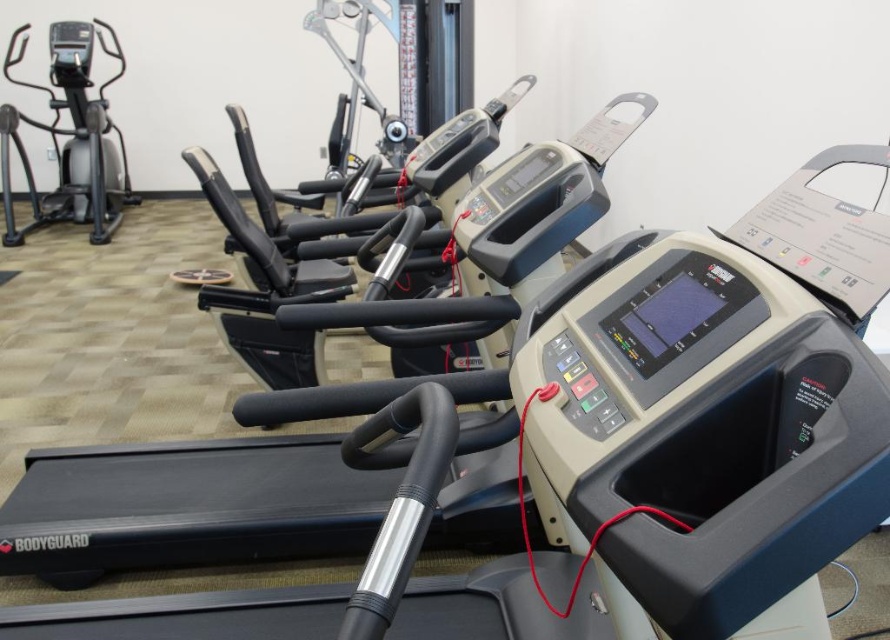
Is black plastic treadmill at center wider than silver metallic elliptical trainer at left?

Yes, black plastic treadmill at center is wider than silver metallic elliptical trainer at left.

Describe the element at coordinates (476, 312) in the screenshot. I see `black plastic treadmill at center` at that location.

The width and height of the screenshot is (890, 640). What are the coordinates of `black plastic treadmill at center` in the screenshot? It's located at (476, 312).